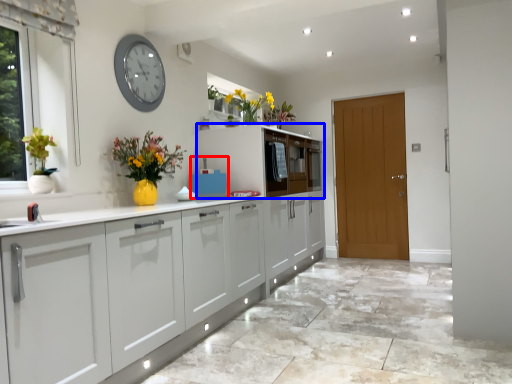
Question: Which object is further to the camera taking this photo, appliance (highlighted by a red box) or cabinetry (highlighted by a blue box)?

Choices:
 (A) appliance
 (B) cabinetry

Answer: (B)